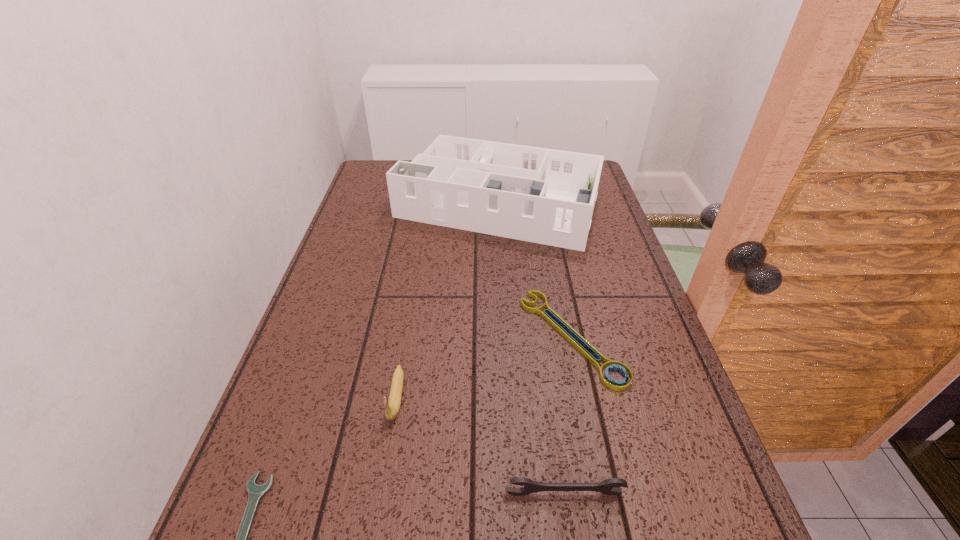
The image size is (960, 540). What are the coordinates of `dollhouse present at the right edge` in the screenshot? It's located at (546, 196).

Identify the location of wrench positioned at the right edge. The height and width of the screenshot is (540, 960). (611, 365).

At what (x,y) coordinates should I click in order to perform the action: click on object that is at the far left corner. Please return your answer as a coordinate pair (x, y). The height and width of the screenshot is (540, 960). Looking at the image, I should click on click(x=546, y=196).

I want to click on object at the far right corner, so click(546, 196).

Identify the location of vacant space at the left edge of the desktop. point(378,221).

This screenshot has width=960, height=540. In the image, there is a desktop. In order to click on vacant space at the right edge in this screenshot , I will do `click(583, 290)`.

Image resolution: width=960 pixels, height=540 pixels. I want to click on blank region between the tallest wrench and the second tallest object, so click(480, 445).

This screenshot has width=960, height=540. What are the coordinates of `vacant space that's between the farthest wrench and the fourth shortest object` in the screenshot? It's located at (484, 367).

At what (x,y) coordinates should I click in order to perform the action: click on free space between the second tallest object and the second shortest wrench. Please return your answer as a coordinate pair (x, y). This screenshot has width=960, height=540. Looking at the image, I should click on (484, 367).

At what (x,y) coordinates should I click in order to perform the action: click on blank region between the tallest wrench and the fourth tallest object. Please return your answer as a coordinate pair (x, y). Looking at the image, I should click on (568, 415).